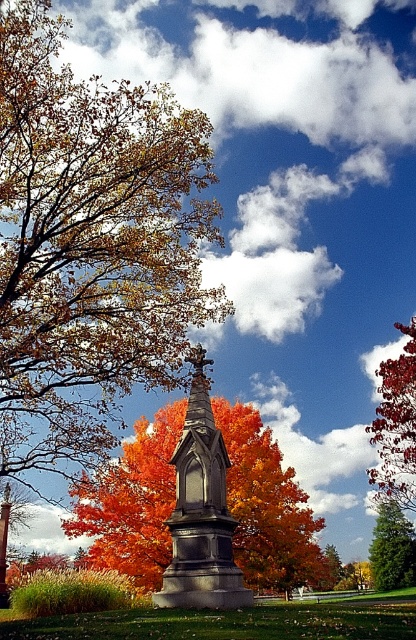
Question: Which of the following is the closest to the observer?

Choices:
 (A) orange leafy tree at center
 (B) smooth red tree at right
 (C) green textured tree at lower right
 (D) autumn leaves at center

Answer: (D)

Question: Does granite monument at center come behind green textured tree at lower right?

Choices:
 (A) no
 (B) yes

Answer: (A)

Question: Which point is farther to the camera?

Choices:
 (A) (193, 380)
 (B) (396, 444)
 (C) (94, 360)
 (D) (235, 476)

Answer: (B)

Question: Can you confirm if granite monument at center is positioned below green textured tree at lower right?

Choices:
 (A) no
 (B) yes

Answer: (A)

Question: Based on their relative distances, which object is nearer to the autumn leaves at center?

Choices:
 (A) orange leafy tree at center
 (B) green textured tree at lower right
 (C) granite monument at center
 (D) smooth red tree at right

Answer: (A)

Question: Is orange leafy tree at center closer to camera compared to granite monument at center?

Choices:
 (A) no
 (B) yes

Answer: (B)